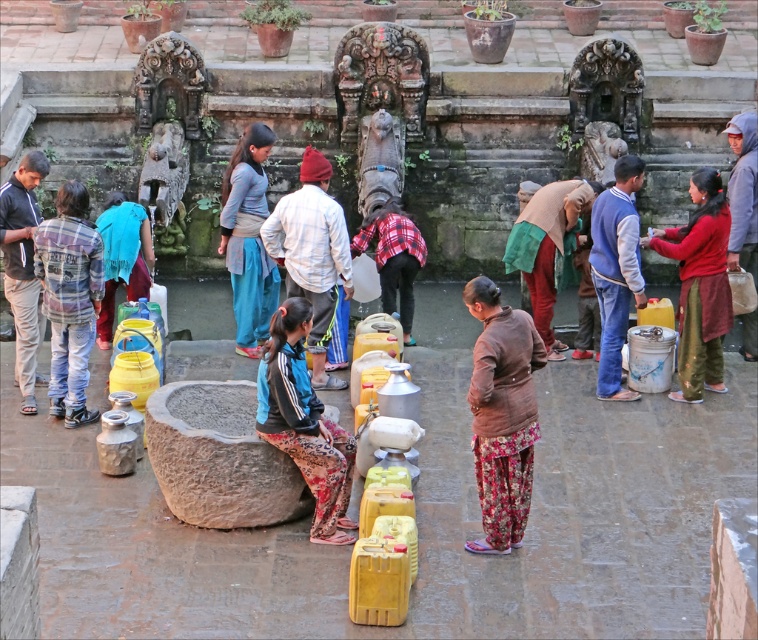
Question: Does blue fabric jacket at center have a smaller size compared to plaid fabric shirt at center?

Choices:
 (A) yes
 (B) no

Answer: (B)

Question: Can you confirm if red cotton dress at right is wider than brown fabric headscarf at center?

Choices:
 (A) no
 (B) yes

Answer: (A)

Question: Can you confirm if plaid fabric shirt at left is positioned to the right of plaid fabric shirt at center?

Choices:
 (A) no
 (B) yes

Answer: (A)

Question: Which point appears closest to the camera in this image?

Choices:
 (A) (537, 196)
 (B) (343, 452)
 (C) (58, 348)
 (D) (716, 285)

Answer: (B)

Question: Which point is farther to the camera?

Choices:
 (A) (309, 304)
 (B) (716, 278)
 (C) (572, 198)
 (D) (409, 236)

Answer: (D)

Question: Which of the following is the closest to the observer?

Choices:
 (A) blue fabric jacket at center
 (B) plaid fabric shirt at left
 (C) plaid fabric shirt at center

Answer: (A)